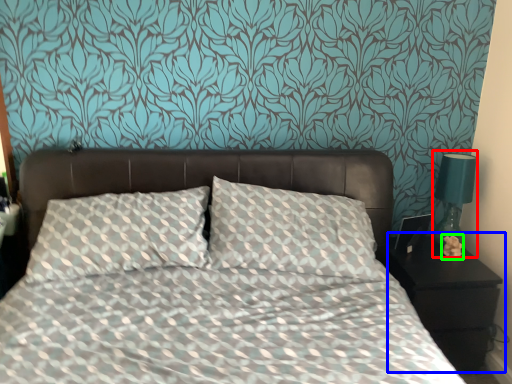
Question: Which is nearer to the bedside lamp (highlighted by a red box)? nightstand (highlighted by a blue box) or flower (highlighted by a green box).

Choices:
 (A) nightstand
 (B) flower

Answer: (B)